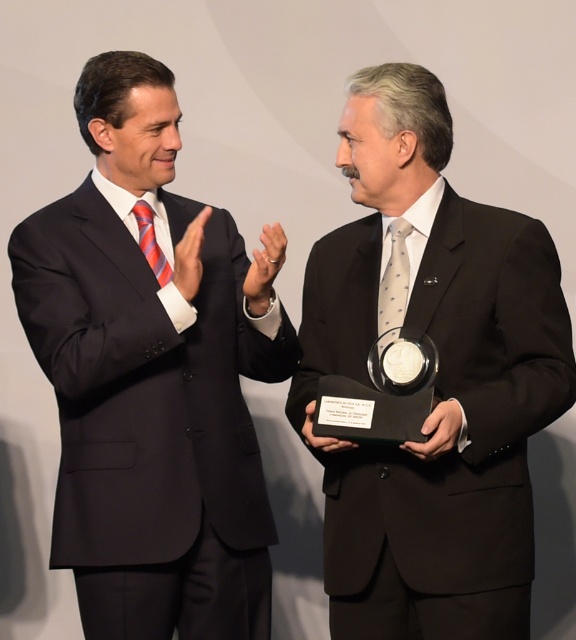
Does matte black suit at left come in front of black matte suit at center?

No, matte black suit at left is further to the viewer.

Is the position of matte black suit at left more distant than that of black matte suit at center?

Yes.

This screenshot has width=576, height=640. What are the coordinates of `matte black suit at left` in the screenshot? It's located at (153, 374).

Locate an element on the screen. Image resolution: width=576 pixels, height=640 pixels. matte black suit at left is located at coordinates (153, 374).